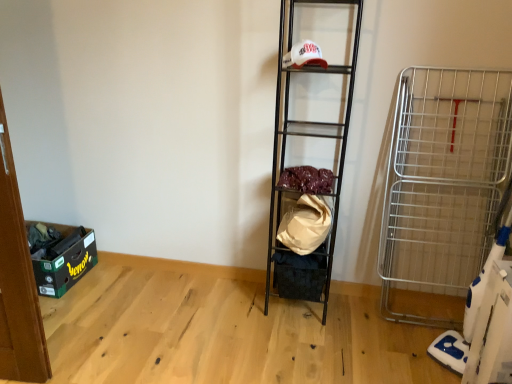
In order to click on vacant area that is in front of metallic black shelf at center in this screenshot , I will do `click(302, 345)`.